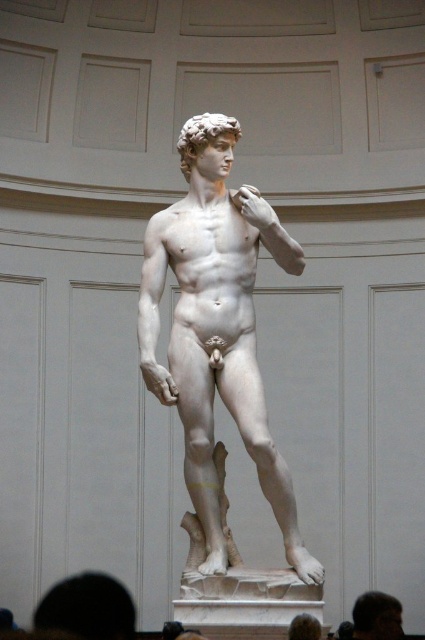
Based on the photo, you are an art student analyzing the statue of David. You notice the white marble statue at center and the light brown hair at lower right. Which object is larger in size?

The white marble statue at center is bigger than the light brown hair at lower right.

You are an art student observing the statue of David. You notice the white marble statue at center and the light brown hair at lower right. Which object is positioned further to the right side of the image?

The light brown hair at lower right is positioned further to the right side of the image than the white marble statue at center.

You are standing in the room where the white marble statue at center is displayed. If you face the statue directly, which direction would you need to turn to see the rectangular panels on the wall behind it?

Since the white marble statue at center is positioned centrally against the plain, light colored wall with a series of rectangular panels, the rectangular panels are likely on the same wall behind the statue. Facing the statue directly, you would need to turn either to your left or right to see the panels, but since the statue is centered, the panels might be on both sides. However, the exact direction depends on the room layout not specified here. But according to the scene description, the statue is in a